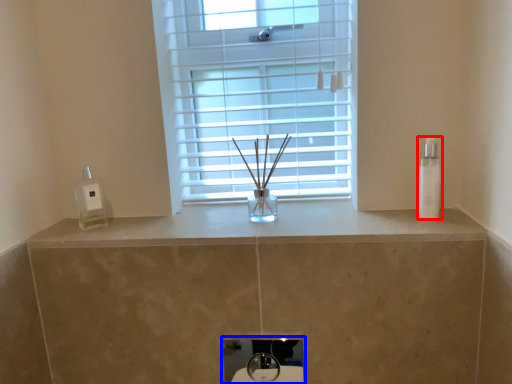
Question: Which of the following is the closest to the observer, toiletry (highlighted by a red box) or sink (highlighted by a blue box)?

Choices:
 (A) toiletry
 (B) sink

Answer: (A)